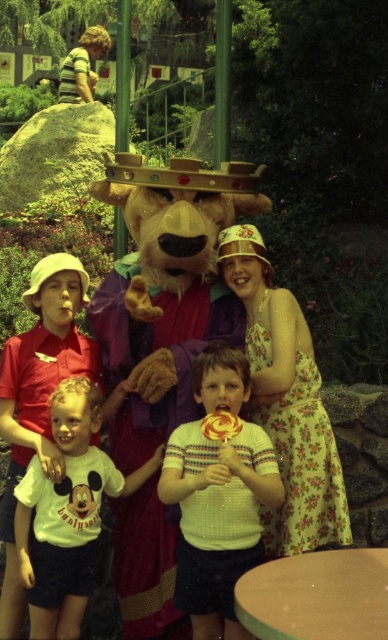
Consider the image. Is fuzzy brown bear at center closer to camera compared to yellow knitted sweater at center?

No, fuzzy brown bear at center is further to the viewer.

Does point (136, 324) come behind point (219, 566)?

Yes, it is behind point (219, 566).

Find the location of a particular element. Image resolution: width=388 pixels, height=640 pixels. fuzzy brown bear at center is located at coordinates (164, 292).

In the scene shown: Which is more to the right, yellow knitted sweater at center or floral dress at center?

floral dress at center is more to the right.

Who is more forward, (204, 356) or (268, 413)?

Point (204, 356) is more forward.

What do you see at coordinates (218, 518) in the screenshot? The height and width of the screenshot is (640, 388). I see `yellow knitted sweater at center` at bounding box center [218, 518].

Where is `yellow knitted sweater at center`? This screenshot has height=640, width=388. yellow knitted sweater at center is located at coordinates (218, 518).

Can you confirm if floral dress at center is positioned to the left of white cotton shirt at center?

In fact, floral dress at center is to the right of white cotton shirt at center.

Is point (270, 378) farther from viewer compared to point (29, 588)?

Yes, point (270, 378) is behind point (29, 588).

The height and width of the screenshot is (640, 388). In order to click on floral dress at center in this screenshot , I will do `click(287, 403)`.